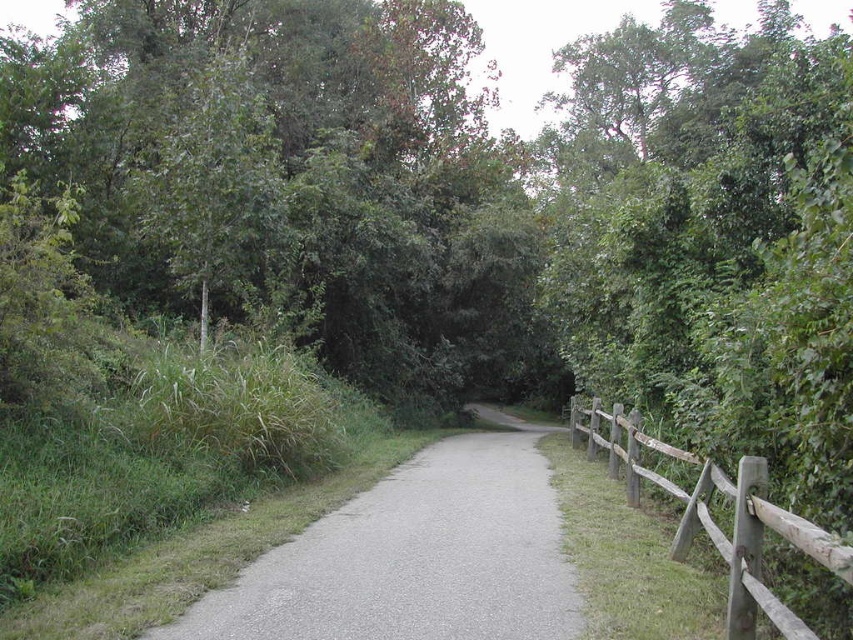
Does green leafy tree at upper left have a smaller size compared to gray asphalt trail at center?

Actually, green leafy tree at upper left might be larger than gray asphalt trail at center.

Is point (276, 115) in front of point (514, 577)?

No, it is behind (514, 577).

Where is `green leafy tree at upper left`? green leafy tree at upper left is located at coordinates (297, 179).

Is point (519, 451) positioned behind point (830, 552)?

Yes, point (519, 451) is farther from viewer.

Which is above, gray asphalt trail at center or brown wooden fence at right?

brown wooden fence at right

Between point (444, 579) and point (750, 474), which one is positioned behind?

The point (444, 579) is behind.

Identify the location of gray asphalt trail at center. This screenshot has width=853, height=640. (415, 557).

Between green leafy tree at upper left and brown wooden fence at right, which one appears on the left side from the viewer's perspective?

From the viewer's perspective, green leafy tree at upper left appears more on the left side.

Describe the element at coordinates (297, 179) in the screenshot. I see `green leafy tree at upper left` at that location.

Is point (107, 163) behind point (759, 474)?

Yes, it is.

This screenshot has width=853, height=640. What are the coordinates of `green leafy tree at upper left` in the screenshot? It's located at (297, 179).